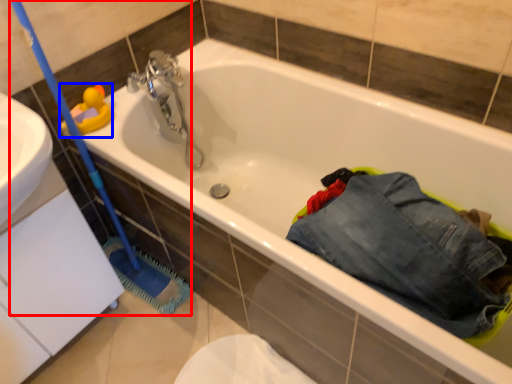
Question: Which point is further to the camera, brush (highlighted by a red box) or toy (highlighted by a blue box)?

Choices:
 (A) brush
 (B) toy

Answer: (B)